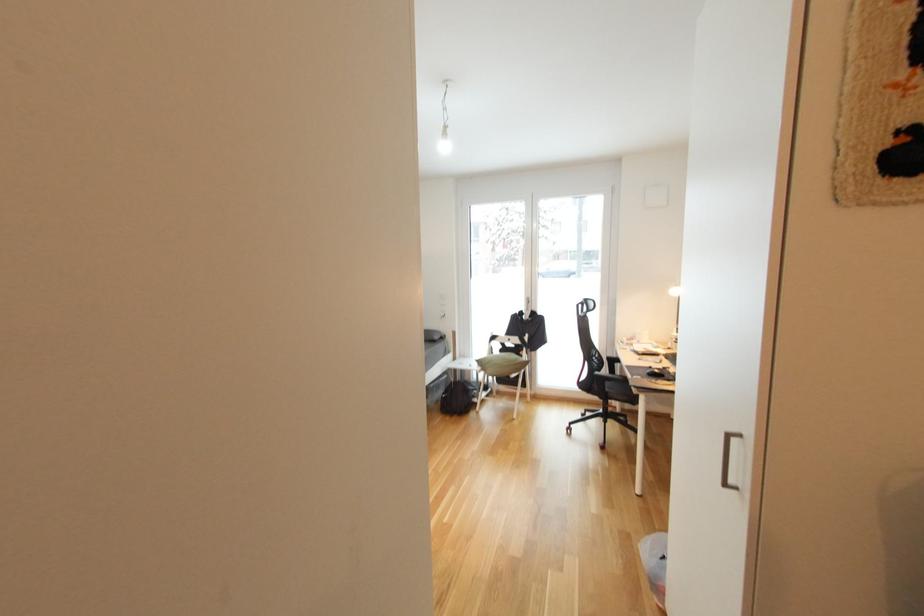
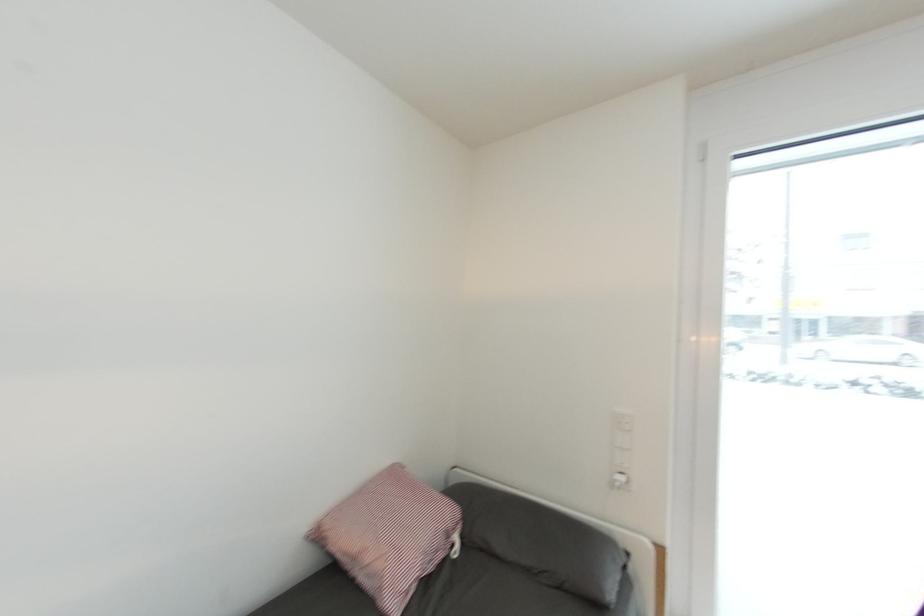
Question: Which direction would the cameraman need to move to produce the second image? Reply with the corresponding letter.

Choices:
 (A) Left
 (B) Right
 (C) Forward
 (D) Backward

Answer: (C)